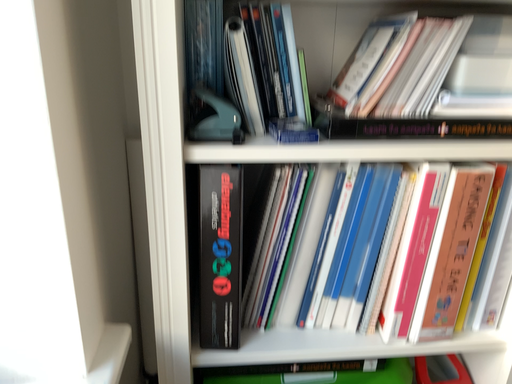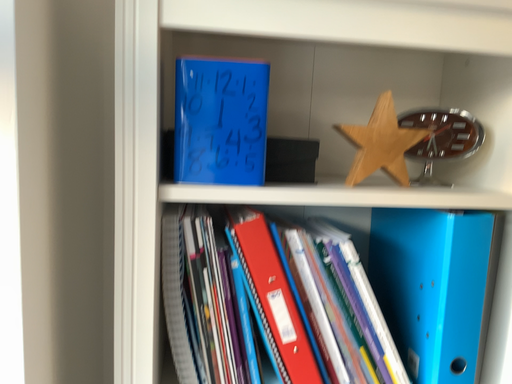
Question: How did the camera likely rotate when shooting the video?

Choices:
 (A) rotated upward
 (B) rotated downward

Answer: (A)